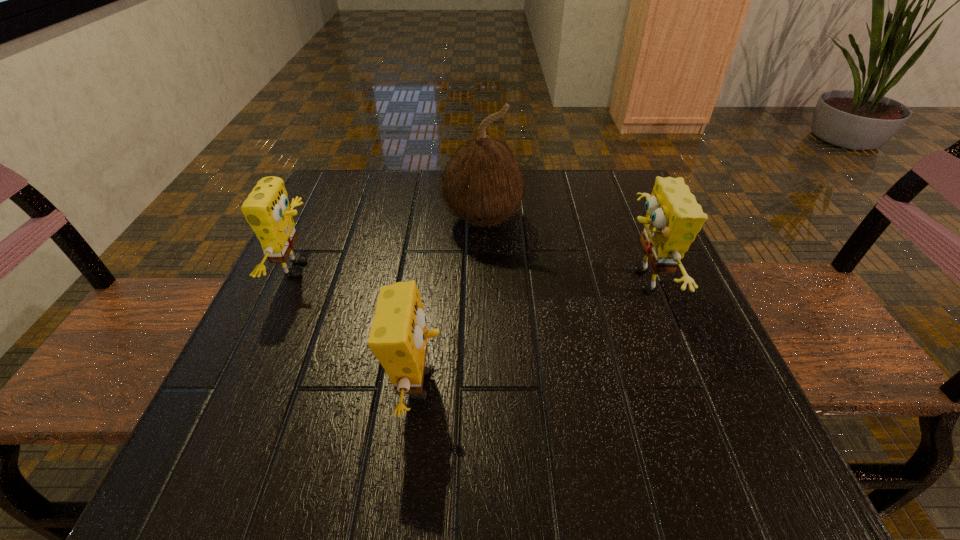
At what (x,y) coordinates should I click in order to perform the action: click on the closest object relative to the rightmost sponge. Please return your answer as a coordinate pair (x, y). This screenshot has width=960, height=540. Looking at the image, I should click on (483, 184).

Point out which object is positioned as the third nearest to the second sponge from right to left. Please provide its 2D coordinates. Your answer should be formatted as a tuple, i.e. [(x, y)], where the tuple contains the x and y coordinates of a point satisfying the conditions above.

[(673, 219)]

The height and width of the screenshot is (540, 960). What are the coordinates of `the second closest sponge relative to the leftmost sponge` in the screenshot? It's located at (673, 219).

Find the location of a particular element. the second closest sponge to the leftmost sponge is located at coordinates (673, 219).

The width and height of the screenshot is (960, 540). I want to click on free space that satisfies the following two spatial constraints: 1. on the surface of the tallest object; 2. on the face of the second sponge from right to left, so click(484, 384).

You are a GUI agent. You are given a task and a screenshot of the screen. Output one action in this format:
    pyautogui.click(x=<x>, y=<y>)
    Task: Click on the free location that satisfies the following two spatial constraints: 1. on the surface of the coconut; 2. on the face of the second sponge from left to right
    The width and height of the screenshot is (960, 540).
    Given the screenshot: What is the action you would take?
    pyautogui.click(x=484, y=384)